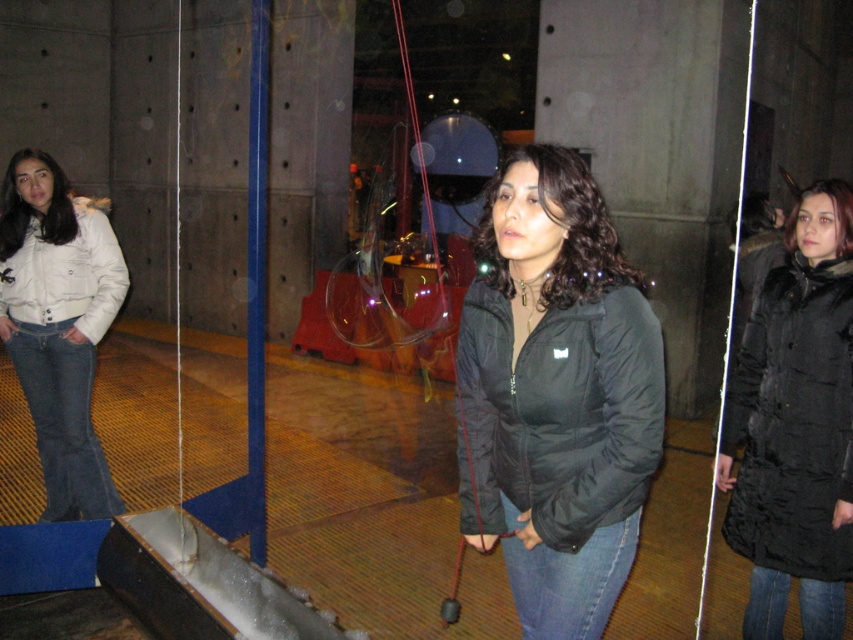
You are a photographer trying to capture a photo of the demonstration. You notice the black puffy coat at right and the transparent glass at lower center. Which object should you focus on to ensure the other is also in the frame?

The black puffy coat at right is positioned on the right side of transparent glass at lower center, so focusing on the transparent glass at lower center would keep the black puffy coat at right in the frame as well.

You are a safety inspector checking the setup for a bubble demonstration. You notice the transparent glass at lower center and the black matte jacket at center. According to safety regulations, the glass must be taller than any nearby objects to prevent accidental collisions. Is the current setup compliant?

The transparent glass at lower center is not as tall as the black matte jacket at center, so the setup does not comply with safety regulations because the glass is shorter than the nearby object.

You are a visitor at this event and want to take a photo of the black puffy coat at right without the transparent glass at lower center appearing in the frame. Based on their distance, can you position yourself in a way to avoid the glass?

The black puffy coat at right and transparent glass at lower center are 5.49 feet apart. Since the distance between them is significant, you can position yourself to the side or further back to frame the black puffy coat at right while excluding the transparent glass at lower center from the shot.